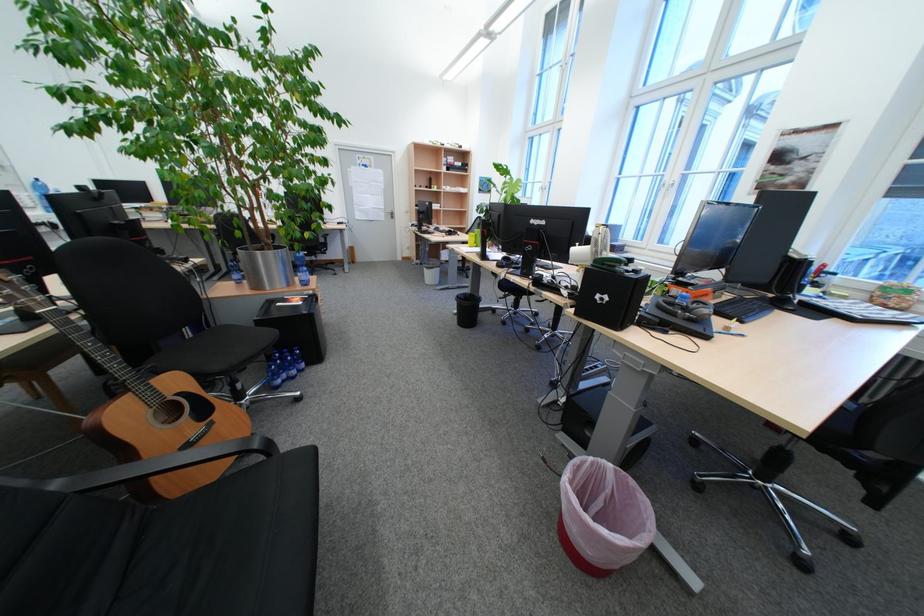
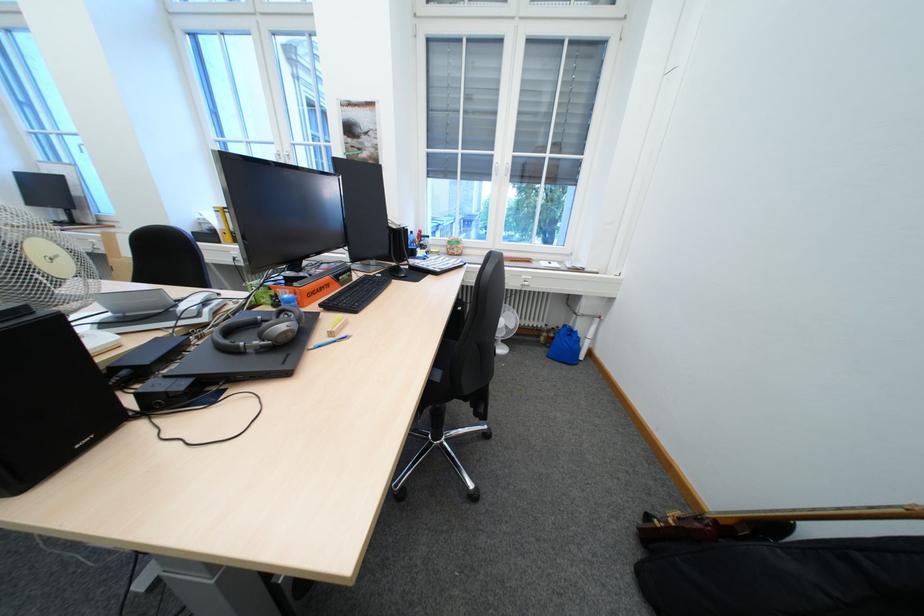
Question: The camera is either moving clockwise (left) or counter-clockwise (right) around the object. The first image is from the beginning of the video and the second image is from the end. Is the camera moving left or right when shooting the video?

Choices:
 (A) Left
 (B) Right

Answer: (A)